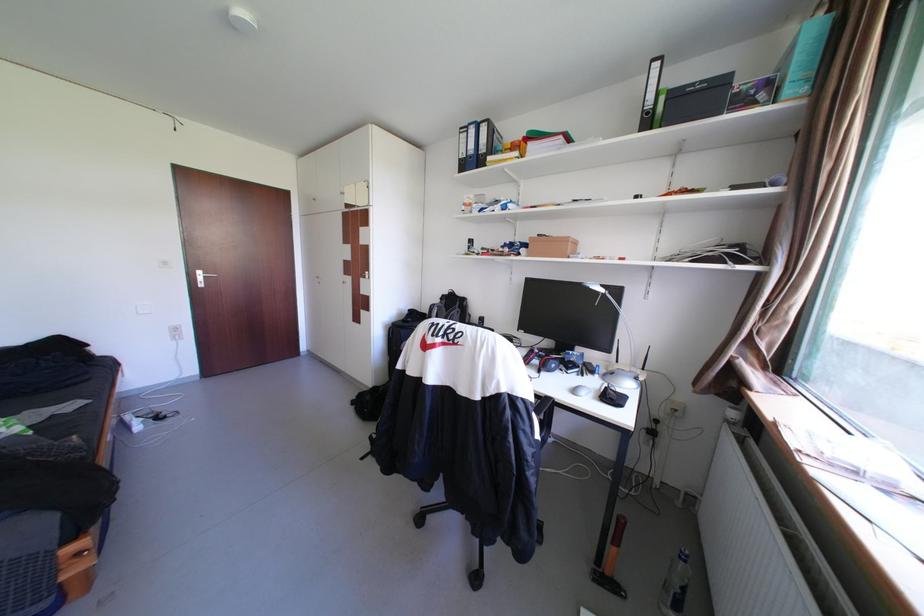
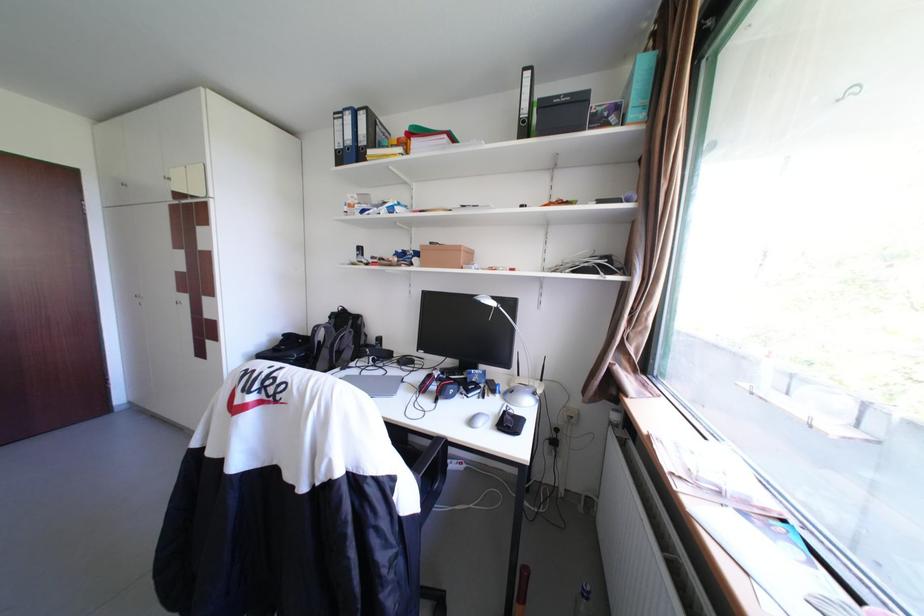
In the second image, find the point that corresponds to point 622,369 in the first image.

(523, 386)